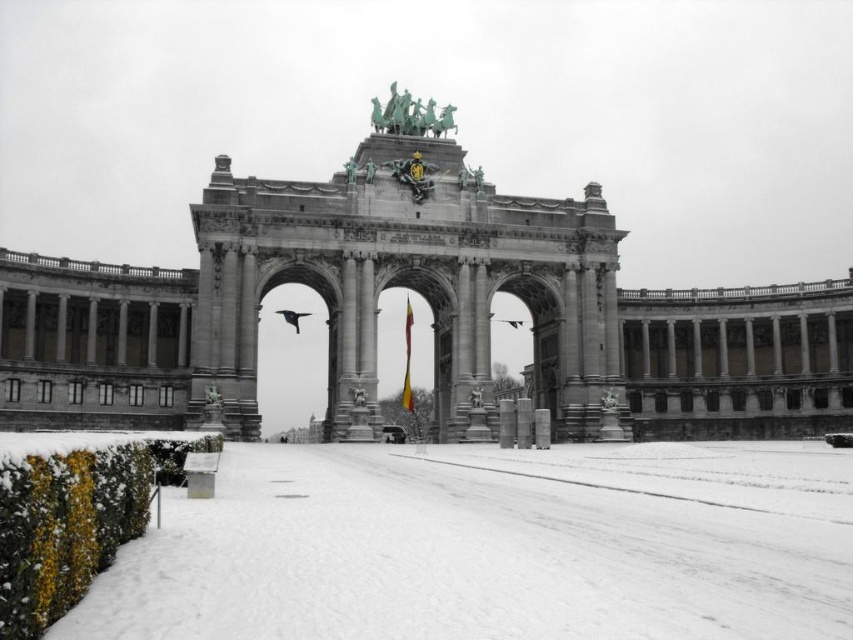
Can you confirm if stone archway at center is smaller than white powdery snow at lower left?

Actually, stone archway at center might be larger than white powdery snow at lower left.

Consider the image. Which of these two, stone archway at center or white powdery snow at lower left, stands shorter?

white powdery snow at lower left

Is point (532, 304) more distant than point (524, 605)?

Yes, it is.

Where is `stone archway at center`? stone archway at center is located at coordinates (425, 300).

Does white powdery snow at lower left come in front of yellow fabric flag at center?

Yes, white powdery snow at lower left is in front of yellow fabric flag at center.

Can you confirm if white powdery snow at lower left is bigger than yellow fabric flag at center?

Yes.

Between point (646, 460) and point (405, 378), which one is positioned behind?

Positioned behind is point (405, 378).

The image size is (853, 640). I want to click on white powdery snow at lower left, so click(492, 547).

Is point (842, 381) closer to viewer compared to point (408, 317)?

Yes, point (842, 381) is in front of point (408, 317).

In the scene shown: Does stone archway at center have a greater width compared to yellow fabric flag at center?

Yes.

Is point (196, 364) positioned before point (410, 314)?

Yes, it is.

Identify the location of stone archway at center. (425, 300).